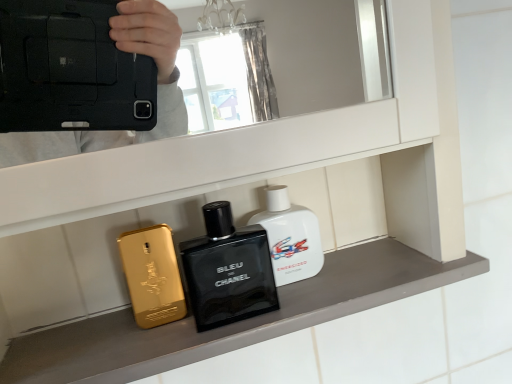
Locate an element on the screen. The image size is (512, 384). vacant area located to the right-hand side of black glass perfume at center is located at coordinates (346, 283).